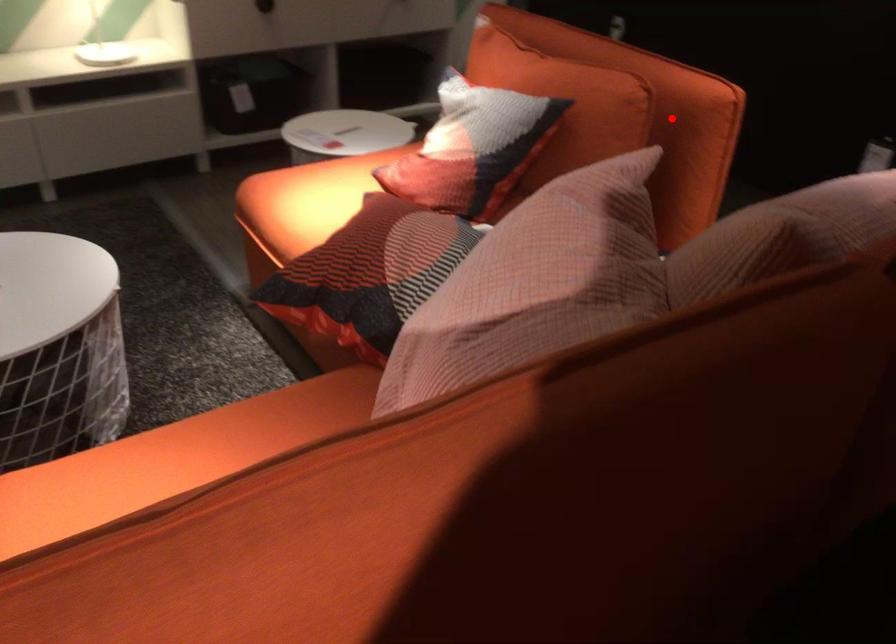
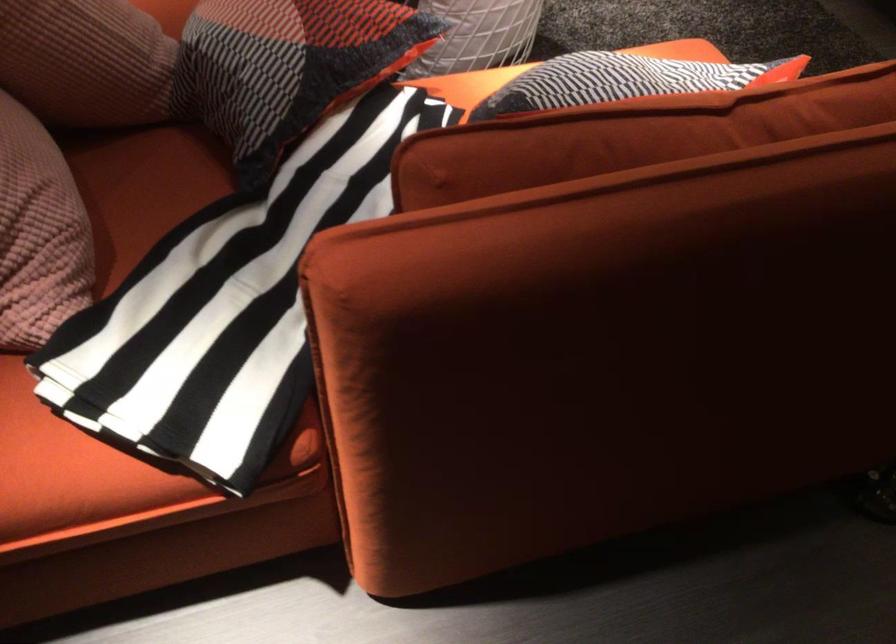
The point at the highlighted location is marked in the first image. Where is the corresponding point in the second image?

(605, 353)